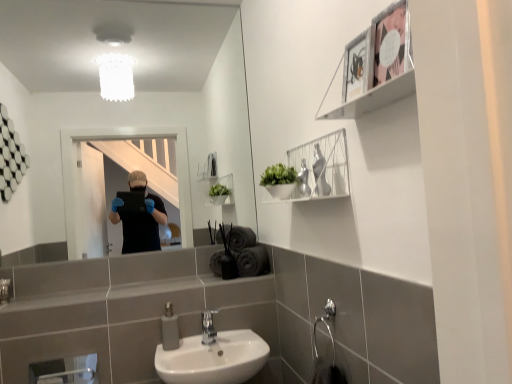
Question: From the image's perspective, is metallic silver frame at upper right, the first cabinet from the top, under white wire shelf at upper center, placed as the second cabinet when sorted from top to bottom?

Choices:
 (A) yes
 (B) no

Answer: (B)

Question: Is the depth of metallic silver frame at upper right, which is the first cabinet from front to back, greater than that of white wire shelf at upper center, the first cabinet positioned from the bottom?

Choices:
 (A) no
 (B) yes

Answer: (A)

Question: Does metallic silver frame at upper right, which ranks as the 2th cabinet in bottom-to-top order, come in front of white wire shelf at upper center, which is counted as the 1th cabinet, starting from the back?

Choices:
 (A) no
 (B) yes

Answer: (B)

Question: Is metallic silver frame at upper right, which is the first cabinet from front to back, directly adjacent to white wire shelf at upper center, positioned as the 2th cabinet in front-to-back order?

Choices:
 (A) yes
 (B) no

Answer: (B)

Question: Is metallic silver frame at upper right, the 2th cabinet positioned from the back, to the left of white wire shelf at upper center, the first cabinet positioned from the bottom, from the viewer's perspective?

Choices:
 (A) no
 (B) yes

Answer: (A)

Question: Is clear glass mirror at upper center wider or thinner than gray matte soap dispenser at lower center?

Choices:
 (A) thin
 (B) wide

Answer: (A)

Question: From the image's perspective, is clear glass mirror at upper center located above or below gray matte soap dispenser at lower center?

Choices:
 (A) above
 (B) below

Answer: (A)

Question: Is point (224, 129) positioned closer to the camera than point (174, 336)?

Choices:
 (A) closer
 (B) farther

Answer: (B)

Question: Is clear glass mirror at upper center in front of or behind gray matte soap dispenser at lower center in the image?

Choices:
 (A) behind
 (B) front

Answer: (A)

Question: From a real-world perspective, is clear glass mirror at upper center positioned above or below white wire shelf at upper center, which is counted as the 1th cabinet, starting from the back?

Choices:
 (A) above
 (B) below

Answer: (A)

Question: Looking at the image, does clear glass mirror at upper center seem bigger or smaller compared to white wire shelf at upper center, which is counted as the 1th cabinet, starting from the back?

Choices:
 (A) big
 (B) small

Answer: (A)

Question: In terms of height, does clear glass mirror at upper center look taller or shorter compared to white wire shelf at upper center, which is counted as the 1th cabinet, starting from the back?

Choices:
 (A) tall
 (B) short

Answer: (A)

Question: From the image's perspective, is clear glass mirror at upper center above or below white wire shelf at upper center, the first cabinet positioned from the bottom?

Choices:
 (A) below
 (B) above

Answer: (B)

Question: Looking at the image, does gray matte soap dispenser at lower center seem bigger or smaller compared to metallic silver frame at upper right, the first cabinet from the top?

Choices:
 (A) small
 (B) big

Answer: (A)

Question: Is gray matte soap dispenser at lower center to the left or to the right of metallic silver frame at upper right, the first cabinet from the top, in the image?

Choices:
 (A) right
 (B) left

Answer: (B)